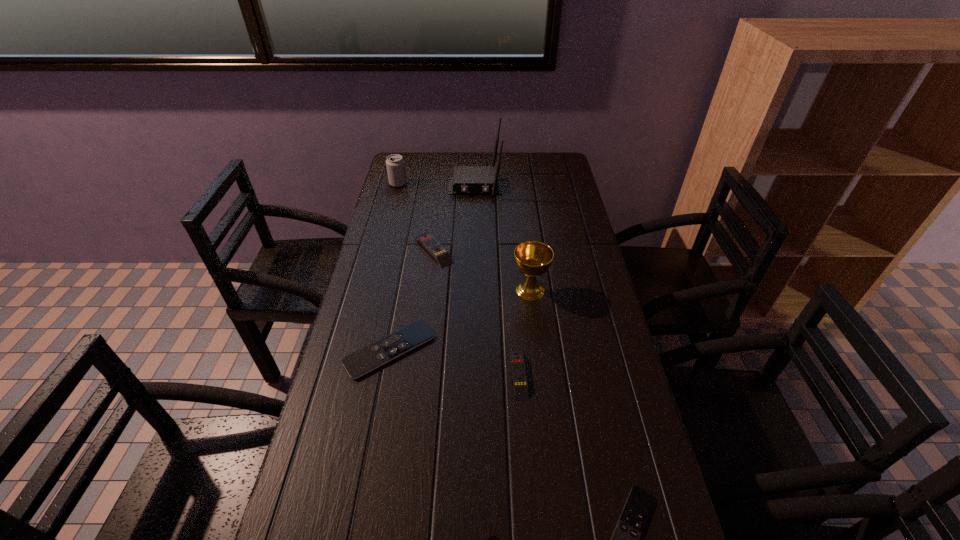
Locate an element on the screen. The image size is (960, 540). free space located 0.120m on the back of the tallest object to connect cables is located at coordinates (475, 219).

In order to click on free point located 0.180m on the front of the chalice in this screenshot , I will do `click(538, 353)`.

At what (x,y) coordinates should I click in order to perform the action: click on vacant area situated on the right of the can. Please return your answer as a coordinate pair (x, y). The width and height of the screenshot is (960, 540). Looking at the image, I should click on (467, 184).

Image resolution: width=960 pixels, height=540 pixels. Find the location of `free space located on the back of the fourth tallest object`. free space located on the back of the fourth tallest object is located at coordinates (441, 187).

Where is `vacant point located on the back of the right yellow remote control`? vacant point located on the back of the right yellow remote control is located at coordinates (514, 312).

Identify the location of free spot located on the back of the third shortest object. This screenshot has height=540, width=960. tap(407, 258).

The height and width of the screenshot is (540, 960). I want to click on router that is at the far edge, so click(466, 180).

Where is `can located in the far edge section of the desktop`? The height and width of the screenshot is (540, 960). can located in the far edge section of the desktop is located at coordinates (395, 164).

Where is `can that is at the left edge`? The image size is (960, 540). can that is at the left edge is located at coordinates (395, 164).

Find the location of a particular element. The height and width of the screenshot is (540, 960). object at the right edge is located at coordinates (533, 258).